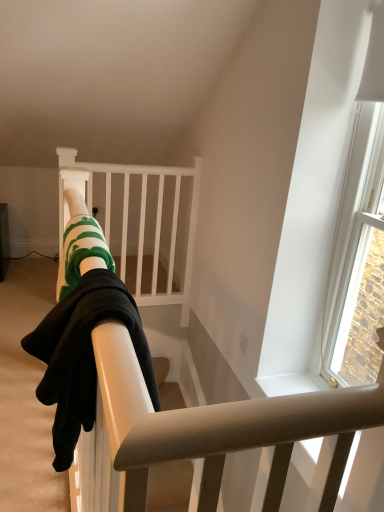
Question: Can green striped socks at center be found inside white matte wooden crib at upper center?

Choices:
 (A) yes
 (B) no

Answer: (B)

Question: From a real-world perspective, is white matte wooden crib at upper center over green striped socks at center?

Choices:
 (A) no
 (B) yes

Answer: (A)

Question: Considering the relative sizes of white matte wooden crib at upper center and green striped socks at center in the image provided, is white matte wooden crib at upper center wider than green striped socks at center?

Choices:
 (A) yes
 (B) no

Answer: (B)

Question: Can you confirm if white matte wooden crib at upper center is smaller than green striped socks at center?

Choices:
 (A) yes
 (B) no

Answer: (B)

Question: Considering the relative positions of white matte wooden crib at upper center and green striped socks at center in the image provided, is white matte wooden crib at upper center to the left of green striped socks at center from the viewer's perspective?

Choices:
 (A) no
 (B) yes

Answer: (B)

Question: From a real-world perspective, is white matte wooden crib at upper center physically below green striped socks at center?

Choices:
 (A) yes
 (B) no

Answer: (A)

Question: Can you confirm if green striped socks at center is wider than white matte wooden crib at upper center?

Choices:
 (A) yes
 (B) no

Answer: (A)

Question: Is green striped socks at center taller than white matte wooden crib at upper center?

Choices:
 (A) no
 (B) yes

Answer: (A)

Question: From the image's perspective, would you say green striped socks at center is positioned over white matte wooden crib at upper center?

Choices:
 (A) no
 (B) yes

Answer: (A)

Question: Does green striped socks at center turn towards white matte wooden crib at upper center?

Choices:
 (A) yes
 (B) no

Answer: (B)

Question: Is green striped socks at center facing away from white matte wooden crib at upper center?

Choices:
 (A) no
 (B) yes

Answer: (A)

Question: Is green striped socks at center positioned beyond the bounds of white matte wooden crib at upper center?

Choices:
 (A) yes
 (B) no

Answer: (A)

Question: Is green striped socks at center bigger or smaller than white matte wooden crib at upper center?

Choices:
 (A) big
 (B) small

Answer: (B)